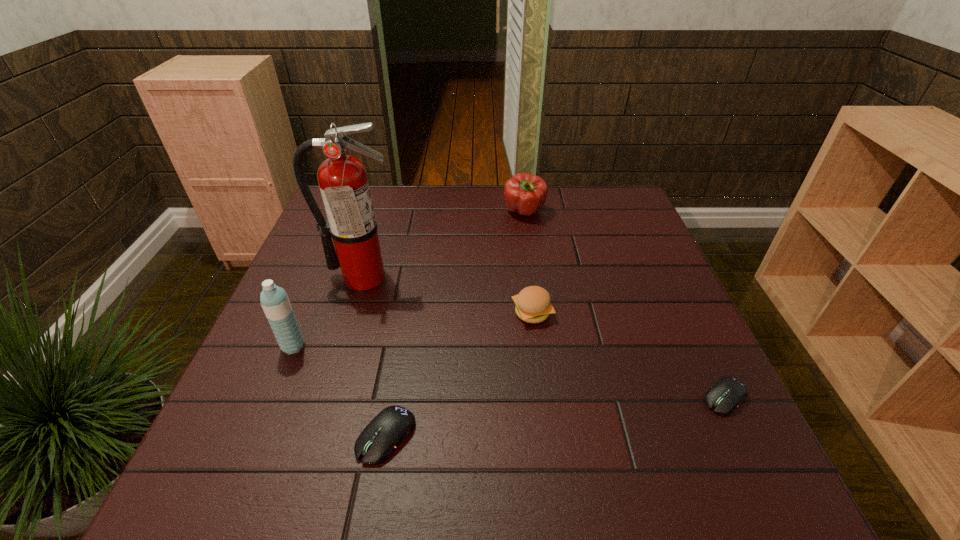
Find the location of a particular element. free space for an extra mouse_(computer_equipment) to achieve even spacing is located at coordinates (562, 416).